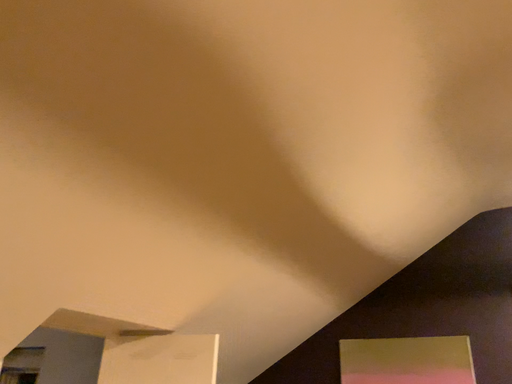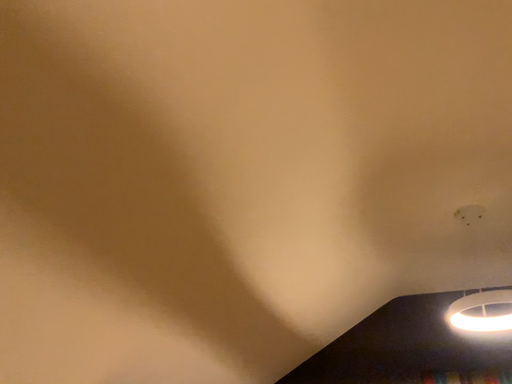
Question: Which way did the camera rotate in the video?

Choices:
 (A) rotated right
 (B) rotated left

Answer: (A)